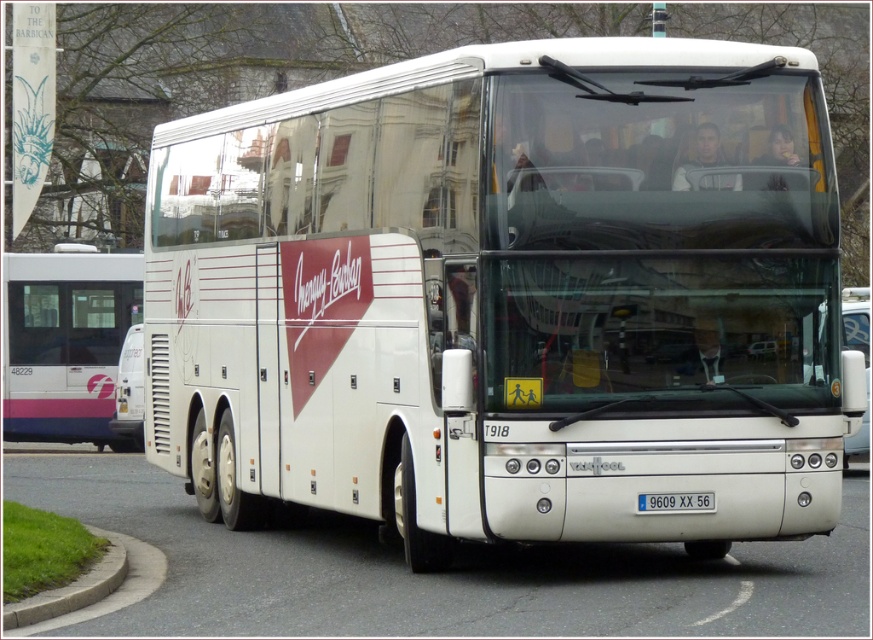
Between white glossy bus at left and white plastic license plate at center, which one has more height?

white glossy bus at left

Between point (49, 339) and point (643, 506), which one is positioned behind?

The point (49, 339) is behind.

This screenshot has width=873, height=640. Find the location of `white glossy bus at left`. white glossy bus at left is located at coordinates (66, 340).

Does white glossy coach at center have a greater width compared to white glossy bus at left?

No, white glossy coach at center is not wider than white glossy bus at left.

Is white glossy coach at center to the right of white glossy bus at left from the viewer's perspective?

Correct, you'll find white glossy coach at center to the right of white glossy bus at left.

Who is more forward, (407, 113) or (33, 339)?

Point (407, 113)

Locate an element on the screen. white glossy coach at center is located at coordinates (507, 296).

How much distance is there between white glossy coach at center and white plastic license plate at center?

white glossy coach at center is 9.06 feet from white plastic license plate at center.

Who is positioned more to the left, white glossy coach at center or white plastic license plate at center?

Positioned to the left is white plastic license plate at center.

Is point (416, 358) positioned before point (684, 499)?

No.

Identify the location of white glossy coach at center. (507, 296).